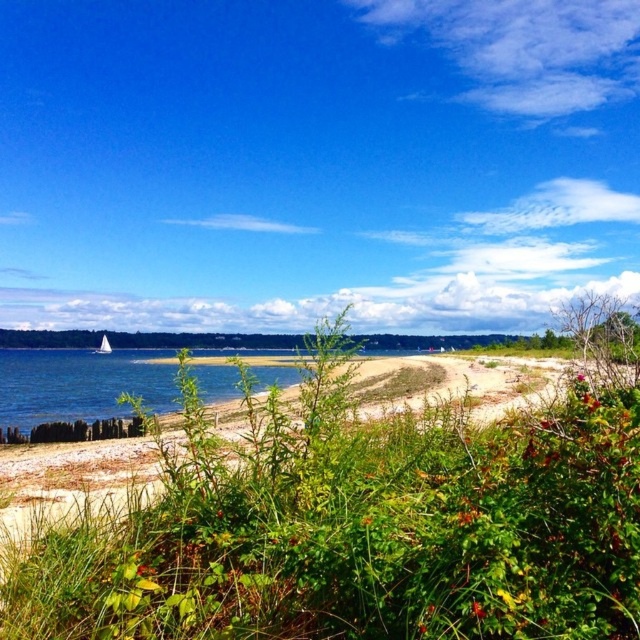
Does green leafy shrubs at center lie in front of white sailboat at left?

Yes.

Does green leafy shrubs at center appear under white sailboat at left?

No.

Find the location of a particular element. green leafy shrubs at center is located at coordinates click(x=362, y=528).

I want to click on green leafy shrubs at center, so click(362, 528).